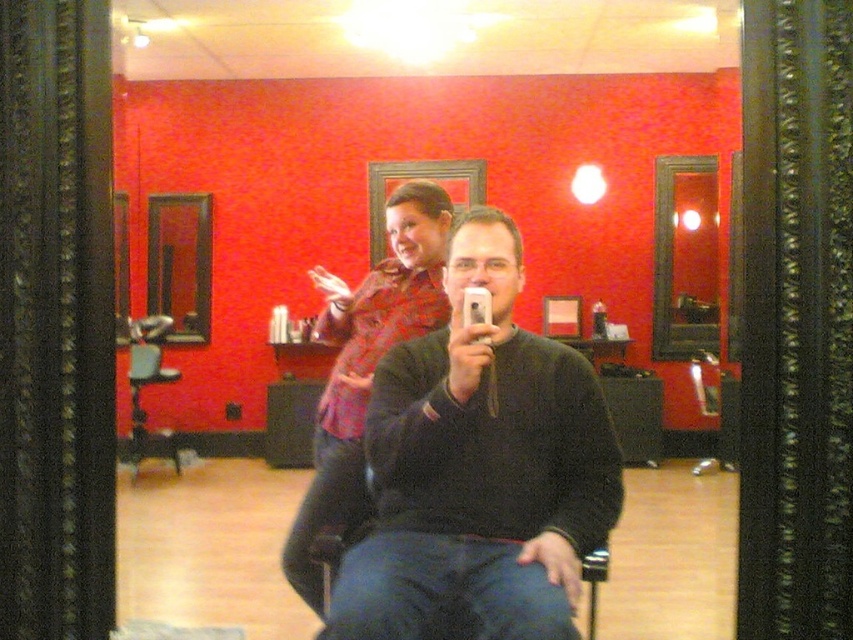
Based on the photo, between black matte sweater at center and matte black mirror at upper right, which one appears on the right side from the viewer's perspective?

matte black mirror at upper right is more to the right.

What do you see at coordinates (479, 470) in the screenshot? I see `black matte sweater at center` at bounding box center [479, 470].

Is point (444, 465) positioned in front of point (680, 275)?

Yes, point (444, 465) is closer to viewer.

Identify the location of black matte sweater at center. The height and width of the screenshot is (640, 853). (479, 470).

Who is higher up, black matte sweater at center or wooden frame mirror at left?

wooden frame mirror at left

Can you confirm if black matte sweater at center is shorter than wooden frame mirror at left?

Correct, black matte sweater at center is not as tall as wooden frame mirror at left.

Consider the image. Who is more distant from viewer, (471, 632) or (171, 195)?

The point (171, 195) is more distant.

The image size is (853, 640). Identify the location of black matte sweater at center. (479, 470).

Which is behind, point (363, 342) or point (158, 196)?

Positioned behind is point (158, 196).

Between red plaid shirt at upper center and wooden frame mirror at left, which one appears on the left side from the viewer's perspective?

wooden frame mirror at left is more to the left.

Who is more distant from viewer, [318,509] or [202,264]?

The point [202,264] is more distant.

You are a GUI agent. You are given a task and a screenshot of the screen. Output one action in this format:
    pyautogui.click(x=<x>, y=<y>)
    Task: Click on the red plaid shirt at upper center
    The image size is (853, 640).
    Given the screenshot: What is the action you would take?
    pyautogui.click(x=364, y=368)